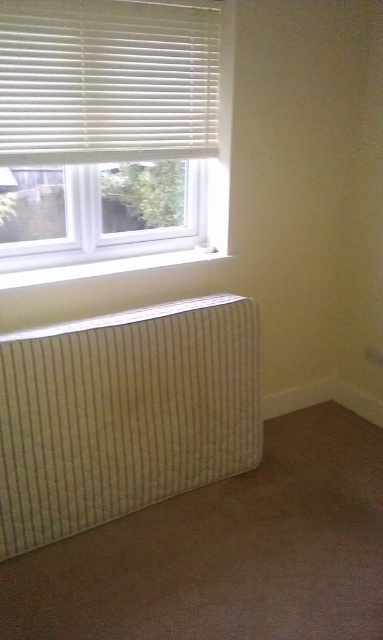
Does beige corduroy radiator at lower left appear on the left side of white plastic blinds at upper left?

Incorrect, beige corduroy radiator at lower left is not on the left side of white plastic blinds at upper left.

This screenshot has height=640, width=383. What do you see at coordinates (124, 413) in the screenshot?
I see `beige corduroy radiator at lower left` at bounding box center [124, 413].

Which is in front, point (201, 483) or point (211, 131)?

Point (201, 483) is more forward.

Locate an element on the screen. The height and width of the screenshot is (640, 383). beige corduroy radiator at lower left is located at coordinates (124, 413).